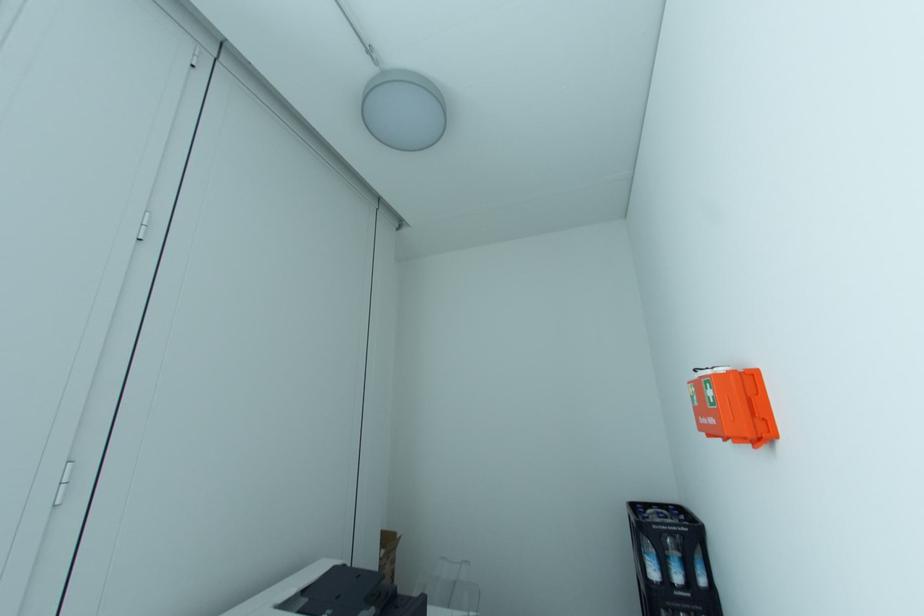
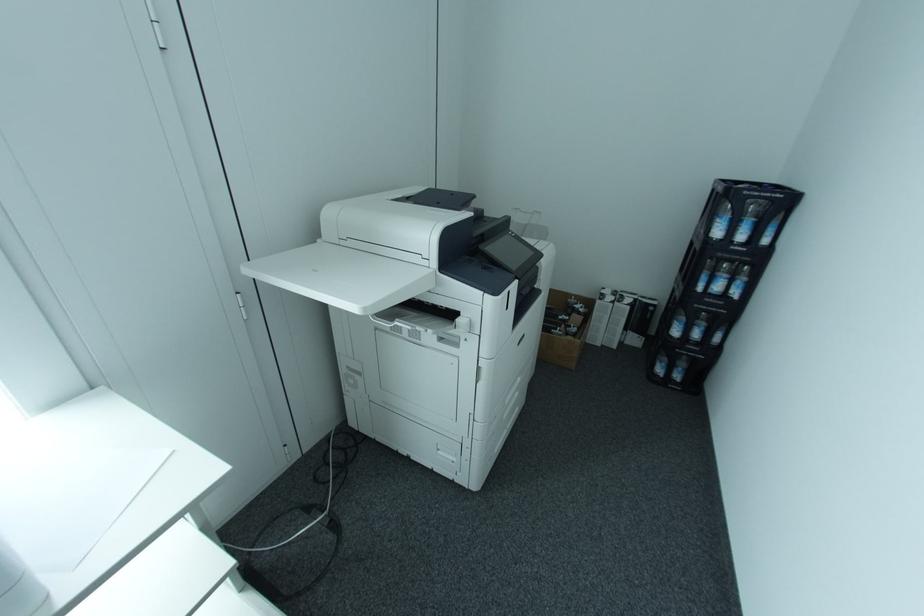
Question: The images are taken continuously from a first-person perspective. In which direction is your viewpoint rotating?

Choices:
 (A) Left
 (B) Right
 (C) Up
 (D) Down

Answer: (D)